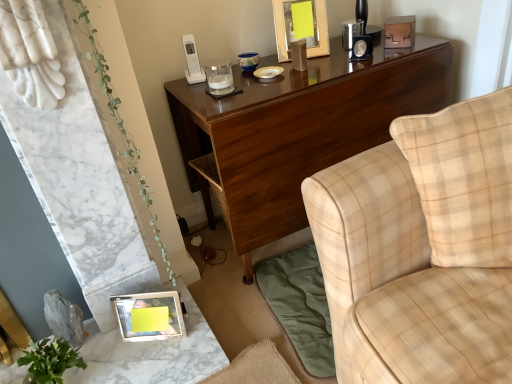
Question: Considering the relative sizes of glossy wood desk at upper center and green leafy plant at lower left in the image provided, is glossy wood desk at upper center shorter than green leafy plant at lower left?

Choices:
 (A) yes
 (B) no

Answer: (A)

Question: From a real-world perspective, is glossy wood desk at upper center positioned under green leafy plant at lower left based on gravity?

Choices:
 (A) yes
 (B) no

Answer: (A)

Question: Is glossy wood desk at upper center thinner than green leafy plant at lower left?

Choices:
 (A) yes
 (B) no

Answer: (B)

Question: Could you tell me if glossy wood desk at upper center is facing green leafy plant at lower left?

Choices:
 (A) no
 (B) yes

Answer: (A)

Question: From the image's perspective, does glossy wood desk at upper center appear lower than green leafy plant at lower left?

Choices:
 (A) yes
 (B) no

Answer: (B)

Question: From a real-world perspective, is glossy wood desk at upper center located higher than green leafy plant at lower left?

Choices:
 (A) yes
 (B) no

Answer: (B)

Question: Is metallic silver photo frame at lower left, the first picture frame viewed from the left, behind yellow paper at upper center, positioned as the 2th picture frame in bottom-to-top order?

Choices:
 (A) yes
 (B) no

Answer: (B)

Question: Are metallic silver photo frame at lower left, which ranks as the 2th picture frame in right-to-left order, and yellow paper at upper center, positioned as the 2th picture frame in bottom-to-top order, located far from each other?

Choices:
 (A) no
 (B) yes

Answer: (B)

Question: Does metallic silver photo frame at lower left, which ranks as the 2th picture frame in right-to-left order, lie in front of yellow paper at upper center, positioned as the 2th picture frame in bottom-to-top order?

Choices:
 (A) no
 (B) yes

Answer: (B)

Question: Is yellow paper at upper center, the first picture frame from the back, completely or partially inside metallic silver photo frame at lower left, which ranks as the 2th picture frame in right-to-left order?

Choices:
 (A) yes
 (B) no

Answer: (B)

Question: Is metallic silver photo frame at lower left, the first picture frame viewed from the left, bigger than yellow paper at upper center, arranged as the second picture frame when viewed from the left?

Choices:
 (A) yes
 (B) no

Answer: (B)

Question: Can you confirm if metallic silver photo frame at lower left, which ranks as the 2th picture frame in right-to-left order, is wider than yellow paper at upper center, arranged as the second picture frame when viewed from the left?

Choices:
 (A) no
 (B) yes

Answer: (A)

Question: Is metallic silver frame at lower left to the left of metallic silver photo frame at lower left, the 1th picture frame viewed from the front, from the viewer's perspective?

Choices:
 (A) yes
 (B) no

Answer: (A)